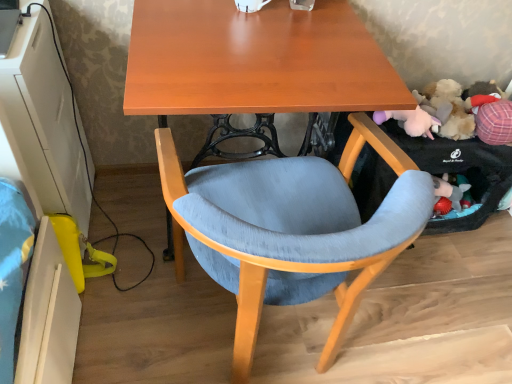
Question: Considering the positions of fluffy plush toy at right and matte wood desk at center in the image, is fluffy plush toy at right taller or shorter than matte wood desk at center?

Choices:
 (A) short
 (B) tall

Answer: (A)

Question: Would you say fluffy plush toy at right is inside or outside matte wood desk at center?

Choices:
 (A) inside
 (B) outside

Answer: (B)

Question: Which object is the farthest from the fluffy plush toy at right?

Choices:
 (A) white glossy computer desk at lower left
 (B) matte wood desk at center
 (C) textured fabric chair at center

Answer: (A)

Question: Which is farther from the textured fabric chair at center?

Choices:
 (A) white glossy computer desk at lower left
 (B) fluffy plush toy at right
 (C) matte wood desk at center

Answer: (B)